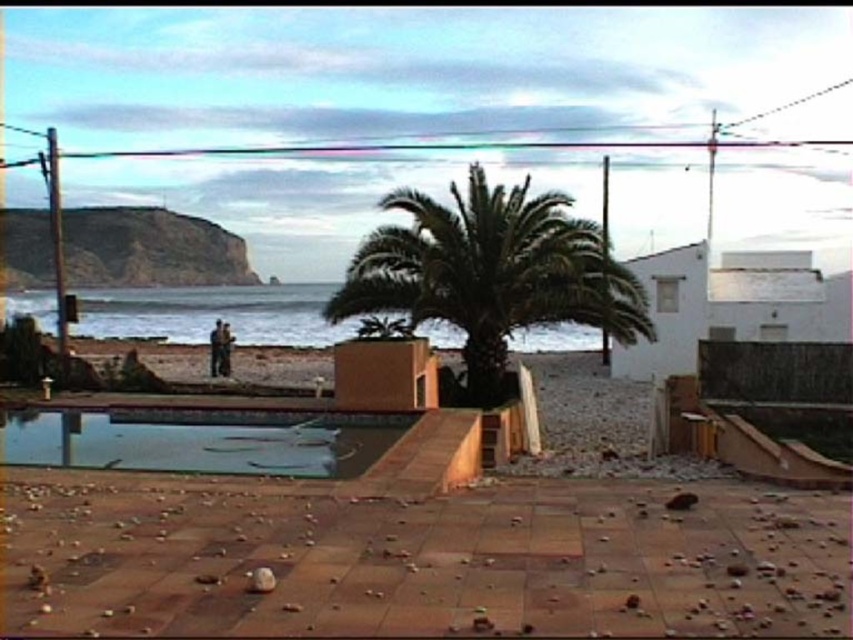
You are planning to place a large statue that is 1.5 meters wide in the foreground of the coastal scene. Given the green leafy palm tree at center and the transparent glass pool at center, which object would you need to consider in terms of space availability for the statue?

The transparent glass pool at center is smaller than the green leafy palm tree at center, so placing the statue near the transparent glass pool at center might be more feasible as it occupies less space.

You are a drone operator trying to capture a photo of two points in the coastal scene. The first point is at coordinates point (495, 364) and the second point is at point (372, 445). Since you want to ensure both points are in focus, you need to know which point is closer to the camera. Which point is closer to the camera?

Point (495, 364) is further to the viewer than point (372, 445). Therefore, point (372, 445) is closer to the camera, so you should adjust the focus accordingly to ensure both points are in focus.

You are a landscape architect designing a new garden. You observe the green leafy palm tree at center and the transparent glass pool at center in the image. Which object is located above the other?

The green leafy palm tree at center is positioned over transparent glass pool at center.